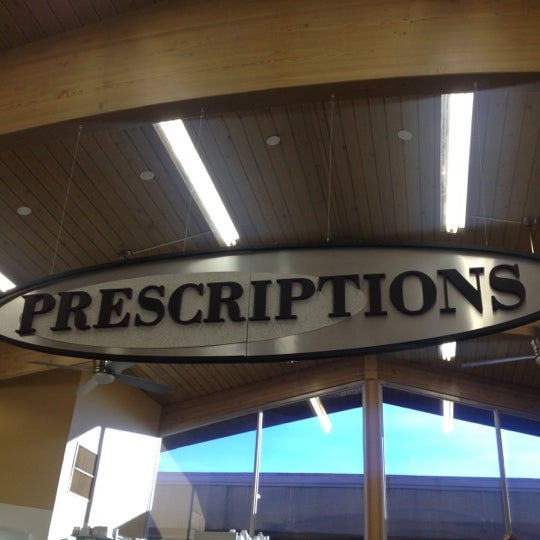
You are a GUI agent. You are given a task and a screenshot of the screen. Output one action in this format:
    pyautogui.click(x=<x>, y=<y>)
    Task: Click on the window frame
    This screenshot has width=540, height=540.
    Given the screenshot: What is the action you would take?
    pyautogui.click(x=253, y=399), pyautogui.click(x=441, y=377), pyautogui.click(x=367, y=454)